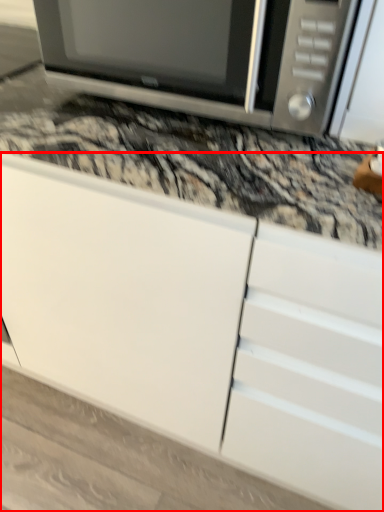
Question: From the image's perspective, where is cabinetry (annotated by the red box) located relative to microwave oven?

Choices:
 (A) above
 (B) below

Answer: (B)